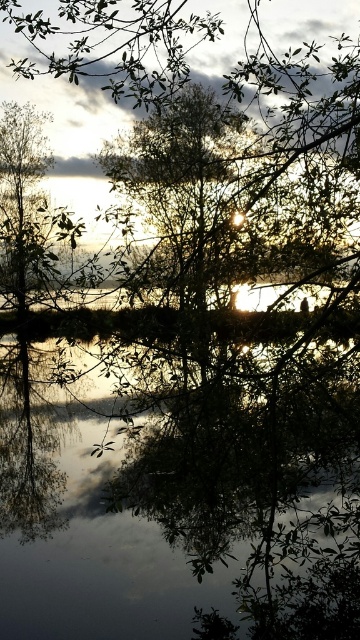
Which is in front, point (83, 19) or point (11, 145)?

Positioned in front is point (83, 19).

Looking at this image, who is shorter, green leafy tree at center or silvery metallic tree at left?

green leafy tree at center is shorter.

Who is more forward, (146,106) or (78,221)?

Positioned in front is point (78,221).

Where is `green leafy tree at center`? This screenshot has width=360, height=640. green leafy tree at center is located at coordinates (113, 44).

Between transparent water at center and silvery metallic tree at left, which one appears on the left side from the viewer's perspective?

silvery metallic tree at left is more to the left.

Does transparent water at center appear on the right side of silvery metallic tree at left?

Indeed, transparent water at center is positioned on the right side of silvery metallic tree at left.

Identify the location of transparent water at center. This screenshot has width=360, height=640. (178, 492).

This screenshot has height=640, width=360. Identify the location of transparent water at center. (178, 492).

Find the location of a particular element. transparent water at center is located at coordinates (178, 492).

Is transparent water at center shorter than green leafy tree at center?

No, transparent water at center is not shorter than green leafy tree at center.

Identify the location of transparent water at center. (178, 492).